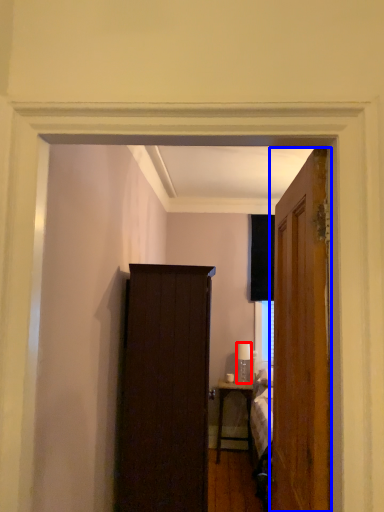
Question: Among these objects, which one is nearest to the camera, lamp (highlighted by a red box) or door (highlighted by a blue box)?

Choices:
 (A) lamp
 (B) door

Answer: (B)